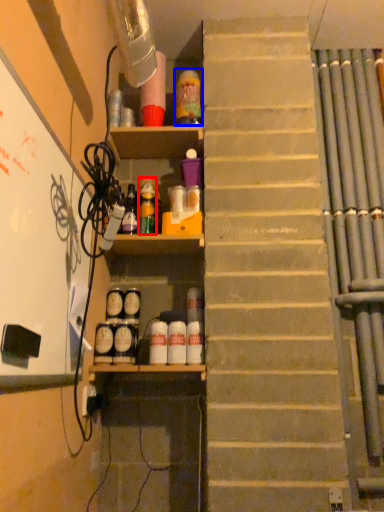
Question: Which point is further to the camera, bottle (highlighted by a red box) or bottle (highlighted by a blue box)?

Choices:
 (A) bottle
 (B) bottle

Answer: (B)